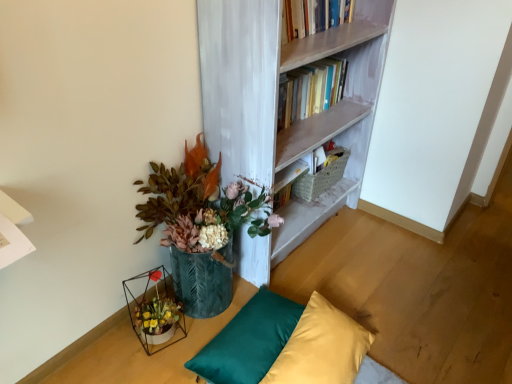
Identify the location of vacant space in front of metallic wire table at lower left. (100, 364).